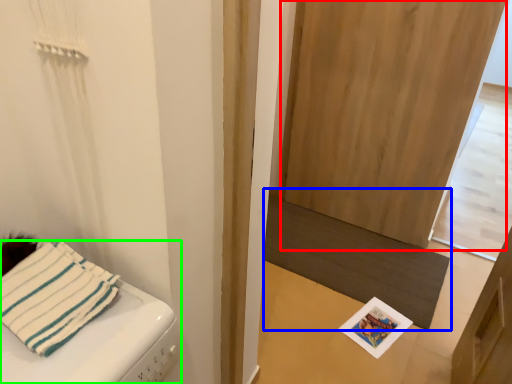
Question: Which is farther away from screen door (highlighted by a red box)? mat (highlighted by a blue box) or furniture (highlighted by a green box)?

Choices:
 (A) mat
 (B) furniture

Answer: (B)